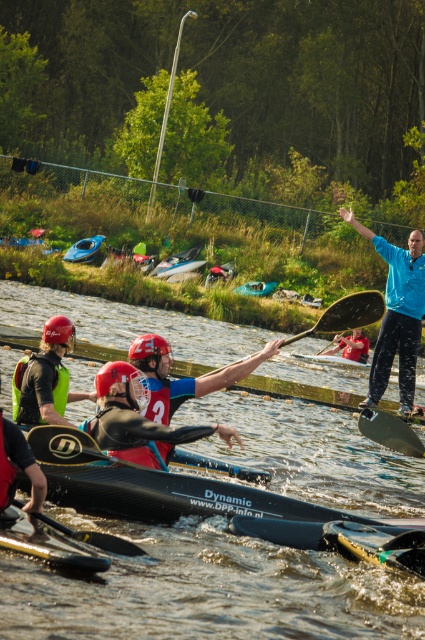
You are standing at the camera position and want to throw a buoy to the point marked as point (345, 212). The buoy has a range of 50 feet. Will it reach the point?

The point (345, 212) is 56.02 feet away from the camera. Since the buoy has a range of 50 feet, it will not reach the point.

Consider the image. You are a photographer trying to capture a photo of the black smooth paddle at center. You notice the blue matte jacket at upper right might block your view. Based on their positions, will the jacket obscure the paddle?

The blue matte jacket at upper right is to the right of the black smooth paddle at center, so it will not block the paddle from view.

You are a photographer positioned at the center of the image. You want to take a photo of the black smooth paddle at center so that it appears in the center of your frame. Is the paddle already positioned where you need it?

The black smooth paddle at center is already positioned at point [390,432], which is the center of the frame, so yes, it is already in the desired position.